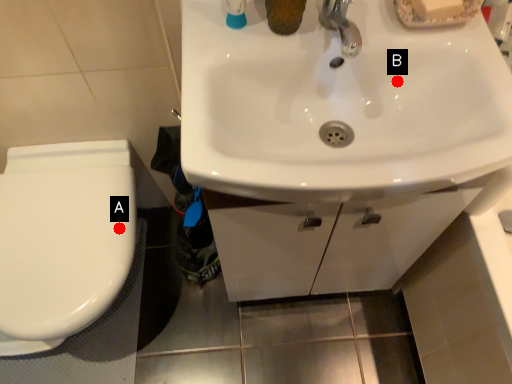
Question: Two points are circled on the image, labeled by A and B beside each circle. Which point is farther from the camera taking this photo?

Choices:
 (A) A is further
 (B) B is further

Answer: (A)